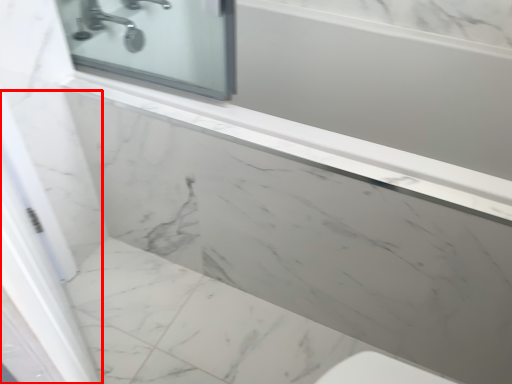
Question: From the image's perspective, what is the correct spatial positioning of screen door (annotated by the red box) in reference to tap?

Choices:
 (A) below
 (B) above

Answer: (A)